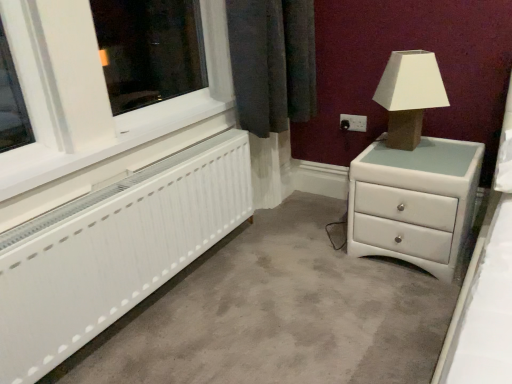
Question: Should I look upward or downward to see white glossy chest of drawers at right?

Choices:
 (A) up
 (B) down

Answer: (B)

Question: Considering the relative sizes of black plastic electric outlet at upper right and matte brown table lamp at upper right in the image provided, is black plastic electric outlet at upper right bigger than matte brown table lamp at upper right?

Choices:
 (A) yes
 (B) no

Answer: (B)

Question: Does black plastic electric outlet at upper right have a greater height compared to matte brown table lamp at upper right?

Choices:
 (A) yes
 (B) no

Answer: (B)

Question: Is black plastic electric outlet at upper right behind matte brown table lamp at upper right?

Choices:
 (A) yes
 (B) no

Answer: (A)

Question: Is black plastic electric outlet at upper right aimed at matte brown table lamp at upper right?

Choices:
 (A) yes
 (B) no

Answer: (B)

Question: Is black plastic electric outlet at upper right to the left of matte brown table lamp at upper right from the viewer's perspective?

Choices:
 (A) yes
 (B) no

Answer: (A)

Question: Is black plastic electric outlet at upper right positioned with its back to matte brown table lamp at upper right?

Choices:
 (A) no
 (B) yes

Answer: (A)

Question: From the image's perspective, would you say white matte radiator at lower left is positioned over white plastic window frame at left?

Choices:
 (A) no
 (B) yes

Answer: (A)

Question: Could you tell me if white matte radiator at lower left is turned towards white plastic window frame at left?

Choices:
 (A) yes
 (B) no

Answer: (B)

Question: Can you confirm if white matte radiator at lower left is smaller than white plastic window frame at left?

Choices:
 (A) yes
 (B) no

Answer: (B)

Question: Is white matte radiator at lower left facing away from white plastic window frame at left?

Choices:
 (A) no
 (B) yes

Answer: (A)

Question: Does white matte radiator at lower left have a greater width compared to white plastic window frame at left?

Choices:
 (A) yes
 (B) no

Answer: (B)

Question: Is white matte radiator at lower left to the right of white plastic window frame at left from the viewer's perspective?

Choices:
 (A) yes
 (B) no

Answer: (A)

Question: Is white glossy chest of drawers at right far away from white plastic window frame at left?

Choices:
 (A) no
 (B) yes

Answer: (A)